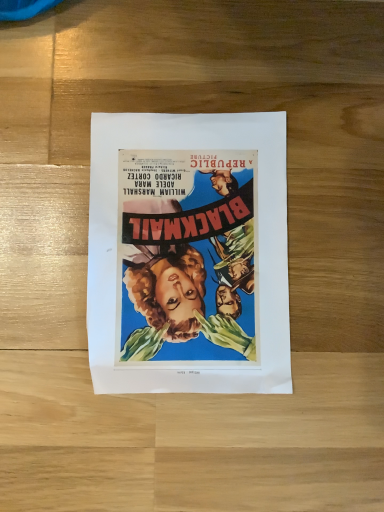
This screenshot has height=512, width=384. What do you see at coordinates (188, 254) in the screenshot?
I see `vibrant paper poster at center` at bounding box center [188, 254].

What is the approximate width of vibrant paper poster at center?

7.94 inches.

This screenshot has height=512, width=384. I want to click on vibrant paper poster at center, so click(188, 254).

Where is `vibrant paper poster at center`? This screenshot has width=384, height=512. vibrant paper poster at center is located at coordinates (188, 254).